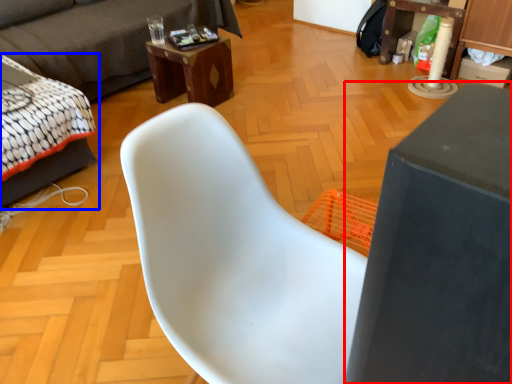
Question: Which of the following is the closest to the observer, table (highlighted by a red box) or bed (highlighted by a blue box)?

Choices:
 (A) table
 (B) bed

Answer: (A)